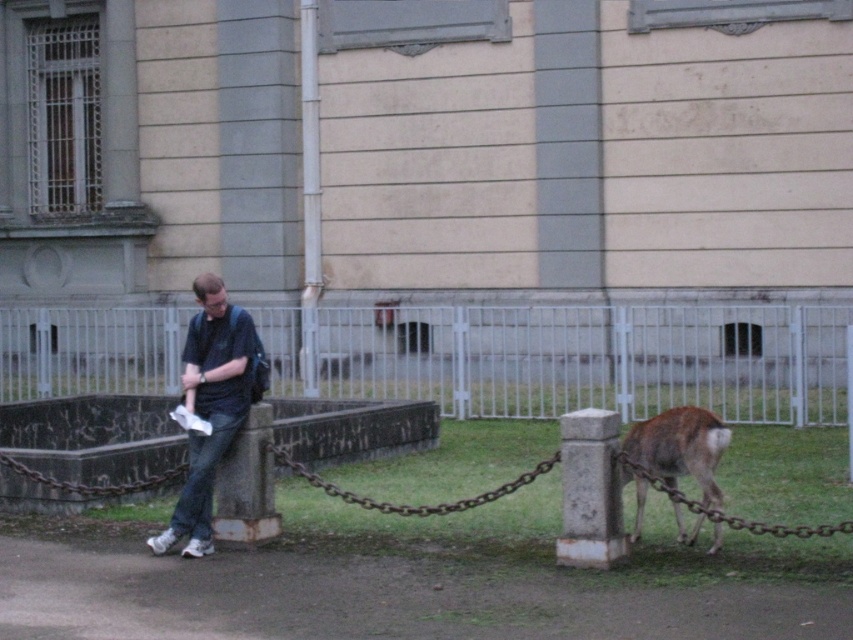
You are a photographer standing at the end of the pathway. You want to take a photo that includes both the brown furry deer at lower right and the rusty metal chain at lower center. Which object should you focus on first to ensure both are in the frame?

The brown furry deer at lower right is closer to the viewer than the rusty metal chain at lower center. To ensure both are in focus, you should focus on the brown furry deer at lower right first since it is closer, and the chain will naturally fall into the depth of field.